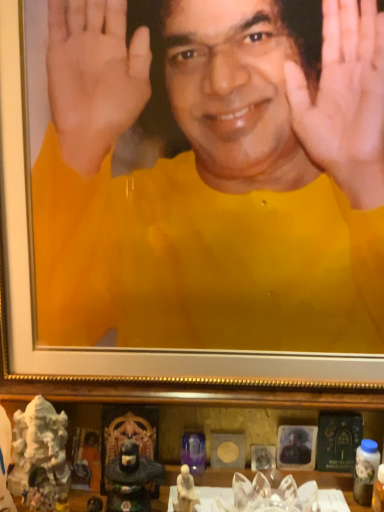
From the picture: How much space does yellow matte shirt at center, marked as the 2th man in a bottom-to-top arrangement, occupy vertically?

yellow matte shirt at center, marked as the 2th man in a bottom-to-top arrangement, is 68.11 centimeters tall.

The image size is (384, 512). What do you see at coordinates (296, 449) in the screenshot?
I see `matte black portrait at lower center, placed as the first man when sorted from right to left` at bounding box center [296, 449].

This screenshot has height=512, width=384. What do you see at coordinates (185, 492) in the screenshot?
I see `white porcelain statue at lower center, placed as the second toy when sorted from left to right` at bounding box center [185, 492].

What is the approximate width of white marble statue at lower left, which is the 2th toy in right-to-left order?

8.95 centimeters.

At what (x,y) coordinates should I click in order to perform the action: click on yellow matte shirt at center, the first man when ordered from left to right. Please return your answer as a coordinate pair (x, y). The image size is (384, 512). Looking at the image, I should click on (214, 182).

Consider the image. Between matte black portrait at lower center, the 2th man positioned from the left, and yellow matte shirt at center, which is the second man in right-to-left order, which one has smaller size?

matte black portrait at lower center, the 2th man positioned from the left.

From the image's perspective, does matte black portrait at lower center, acting as the 2th man starting from the top, appear lower than yellow matte shirt at center, the first man when ordered from left to right?

Indeed, from the image's perspective, matte black portrait at lower center, acting as the 2th man starting from the top, is shown beneath yellow matte shirt at center, the first man when ordered from left to right.

From a real-world perspective, is matte black portrait at lower center, acting as the 2th man starting from the top, positioned over yellow matte shirt at center, marked as the 2th man in a bottom-to-top arrangement, based on gravity?

No, from a real-world perspective, matte black portrait at lower center, acting as the 2th man starting from the top, is not on top of yellow matte shirt at center, marked as the 2th man in a bottom-to-top arrangement.

Is the surface of matte black portrait at lower center, the 2th man positioned from the left, in direct contact with yellow matte shirt at center, which is the second man in right-to-left order?

No, matte black portrait at lower center, the 2th man positioned from the left, is not beside yellow matte shirt at center, which is the second man in right-to-left order.

From the image's perspective, which one is positioned lower, white marble statue at lower left, which is the 2th toy in right-to-left order, or yellow matte shirt at center, the first man when ordered from left to right?

white marble statue at lower left, which is the 2th toy in right-to-left order.

Considering the positions of objects white marble statue at lower left, the first toy in the left-to-right sequence, and yellow matte shirt at center, the 1th man positioned from the top, in the image provided, who is behind, white marble statue at lower left, the first toy in the left-to-right sequence, or yellow matte shirt at center, the 1th man positioned from the top,?

Positioned behind is white marble statue at lower left, the first toy in the left-to-right sequence.

Is yellow matte shirt at center, marked as the 2th man in a bottom-to-top arrangement, a part of white marble statue at lower left, the first toy in the left-to-right sequence?

No, white marble statue at lower left, the first toy in the left-to-right sequence, does not contain yellow matte shirt at center, marked as the 2th man in a bottom-to-top arrangement.

From a real-world perspective, is white marble statue at lower left, which is the 2th toy in right-to-left order, above or below yellow matte shirt at center, the 1th man positioned from the top?

white marble statue at lower left, which is the 2th toy in right-to-left order, is situated lower than yellow matte shirt at center, the 1th man positioned from the top, in the real world.

Considering the relative sizes of white marble statue at lower left, which is the 2th toy in right-to-left order, and matte black portrait at lower center, placed as the first man when sorted from bottom to top, in the image provided, is white marble statue at lower left, which is the 2th toy in right-to-left order, taller than matte black portrait at lower center, placed as the first man when sorted from bottom to top,?

Yes.

Is white marble statue at lower left, which is the 2th toy in right-to-left order, facing towards matte black portrait at lower center, placed as the first man when sorted from bottom to top?

No, white marble statue at lower left, which is the 2th toy in right-to-left order, is not facing towards matte black portrait at lower center, placed as the first man when sorted from bottom to top.

Looking at this image, is matte black portrait at lower center, placed as the first man when sorted from bottom to top, not close to white porcelain statue at lower center, the first toy viewed from the right?

No, there isn't a large distance between matte black portrait at lower center, placed as the first man when sorted from bottom to top, and white porcelain statue at lower center, the first toy viewed from the right.

From a real-world perspective, is matte black portrait at lower center, acting as the 2th man starting from the top, positioned above or below white porcelain statue at lower center, placed as the second toy when sorted from left to right?

matte black portrait at lower center, acting as the 2th man starting from the top, is above white porcelain statue at lower center, placed as the second toy when sorted from left to right.

From the image's perspective, is matte black portrait at lower center, the 2th man positioned from the left, located beneath white porcelain statue at lower center, the first toy viewed from the right?

Actually, matte black portrait at lower center, the 2th man positioned from the left, appears above white porcelain statue at lower center, the first toy viewed from the right, in the image.

Considering the positions of objects yellow matte shirt at center, marked as the 2th man in a bottom-to-top arrangement, and white marble statue at lower left, which is the 2th toy in right-to-left order, in the image provided, who is more to the right, yellow matte shirt at center, marked as the 2th man in a bottom-to-top arrangement, or white marble statue at lower left, which is the 2th toy in right-to-left order,?

Positioned to the right is yellow matte shirt at center, marked as the 2th man in a bottom-to-top arrangement.

Considering the relative sizes of yellow matte shirt at center, marked as the 2th man in a bottom-to-top arrangement, and white marble statue at lower left, the first toy in the left-to-right sequence, in the image provided, is yellow matte shirt at center, marked as the 2th man in a bottom-to-top arrangement, bigger than white marble statue at lower left, the first toy in the left-to-right sequence,?

Yes.

Is yellow matte shirt at center, which is the second man in right-to-left order, in contact with white marble statue at lower left, which is the 2th toy in right-to-left order?

No, yellow matte shirt at center, which is the second man in right-to-left order, is not touching white marble statue at lower left, which is the 2th toy in right-to-left order.

Is point (197, 175) closer or farther from the camera than point (34, 465)?

Point (197, 175).

What's the angular difference between matte black portrait at lower center, placed as the first man when sorted from bottom to top, and white marble statue at lower left, the first toy in the left-to-right sequence,'s facing directions?

They differ by 11.9 degrees in their facing directions.

Which is behind, matte black portrait at lower center, the 2th man positioned from the left, or white marble statue at lower left, which is the 2th toy in right-to-left order?

matte black portrait at lower center, the 2th man positioned from the left, is behind.

Looking at this image, is matte black portrait at lower center, placed as the first man when sorted from bottom to top, aimed at white marble statue at lower left, the first toy in the left-to-right sequence?

No, matte black portrait at lower center, placed as the first man when sorted from bottom to top, is not oriented towards white marble statue at lower left, the first toy in the left-to-right sequence.

Is matte black portrait at lower center, placed as the first man when sorted from bottom to top, not near white marble statue at lower left, the first toy in the left-to-right sequence?

They are positioned close to each other.

Can you confirm if matte black statue at lower center is wider than white marble statue at lower left, the first toy in the left-to-right sequence?

Incorrect, the width of matte black statue at lower center does not surpass that of white marble statue at lower left, the first toy in the left-to-right sequence.

Measure the distance from matte black statue at lower center to white marble statue at lower left, the first toy in the left-to-right sequence.

matte black statue at lower center is 4.98 inches away from white marble statue at lower left, the first toy in the left-to-right sequence.

Is matte black statue at lower center bigger or smaller than white marble statue at lower left, the first toy in the left-to-right sequence?

matte black statue at lower center is smaller than white marble statue at lower left, the first toy in the left-to-right sequence.

Which is behind, point (136, 459) or point (53, 489)?

The point (136, 459) is farther from the camera.

Image resolution: width=384 pixels, height=512 pixels. I want to click on man that appears below the yellow matte shirt at center, the first man when ordered from left to right (from the image's perspective), so click(x=296, y=449).

Find the location of a particular element. Image resolution: width=384 pixels, height=512 pixels. man above the white marble statue at lower left, which is the 2th toy in right-to-left order (from the image's perspective) is located at coordinates (214, 182).

Considering their positions, is white porcelain statue at lower center, the first toy viewed from the right, positioned closer to matte black statue at lower center than yellow matte shirt at center, which is the second man in right-to-left order?

white porcelain statue at lower center, the first toy viewed from the right, is positioned closer to the anchor matte black statue at lower center.

Based on their spatial positions, is matte black statue at lower center or white porcelain statue at lower center, placed as the second toy when sorted from left to right, closer to yellow matte shirt at center, which is the second man in right-to-left order?

matte black statue at lower center lies closer to yellow matte shirt at center, which is the second man in right-to-left order, than the other object.

Which object lies nearer to the anchor point white marble statue at lower left, the first toy in the left-to-right sequence, matte black portrait at lower center, placed as the first man when sorted from bottom to top, or white porcelain statue at lower center, the first toy viewed from the right?

The object closer to white marble statue at lower left, the first toy in the left-to-right sequence, is white porcelain statue at lower center, the first toy viewed from the right.

Estimate the real-world distances between objects in this image. Which object is further from yellow matte shirt at center, the first man when ordered from left to right, white porcelain statue at lower center, placed as the second toy when sorted from left to right, or matte black statue at lower center?

Among the two, white porcelain statue at lower center, placed as the second toy when sorted from left to right, is located further to yellow matte shirt at center, the first man when ordered from left to right.

Looking at this image, which object lies nearer to the anchor point white porcelain statue at lower center, placed as the second toy when sorted from left to right, matte black statue at lower center or yellow matte shirt at center, which is the second man in right-to-left order?

matte black statue at lower center lies closer to white porcelain statue at lower center, placed as the second toy when sorted from left to right, than the other object.

Based on their spatial positions, is yellow matte shirt at center, the 1th man positioned from the top, or matte black portrait at lower center, acting as the 2th man starting from the top, further from matte black statue at lower center?

The object further to matte black statue at lower center is yellow matte shirt at center, the 1th man positioned from the top.

When comparing their distances from yellow matte shirt at center, marked as the 2th man in a bottom-to-top arrangement, does white porcelain statue at lower center, placed as the second toy when sorted from left to right, or white marble statue at lower left, which is the 2th toy in right-to-left order, seem closer?

white marble statue at lower left, which is the 2th toy in right-to-left order, lies closer to yellow matte shirt at center, marked as the 2th man in a bottom-to-top arrangement, than the other object.

From the image, which object appears to be nearer to white porcelain statue at lower center, the first toy viewed from the right, matte black portrait at lower center, placed as the first man when sorted from bottom to top, or matte black statue at lower center?

matte black statue at lower center is positioned closer to the anchor white porcelain statue at lower center, the first toy viewed from the right.

Find the location of `toy between matte black statue at lower center and matte black portrait at lower center, acting as the 2th man starting from the top, from left to right`. toy between matte black statue at lower center and matte black portrait at lower center, acting as the 2th man starting from the top, from left to right is located at coordinates (185, 492).

Locate an element on the screen. This screenshot has width=384, height=512. toy between yellow matte shirt at center, the 1th man positioned from the top, and matte black portrait at lower center, acting as the 2th man starting from the top, vertically is located at coordinates point(39,456).

Identify the location of figurine between white marble statue at lower left, which is the 2th toy in right-to-left order, and white porcelain statue at lower center, placed as the second toy when sorted from left to right. (131, 479).

The image size is (384, 512). Identify the location of man between yellow matte shirt at center, marked as the 2th man in a bottom-to-top arrangement, and white porcelain statue at lower center, placed as the second toy when sorted from left to right, vertically. (296, 449).